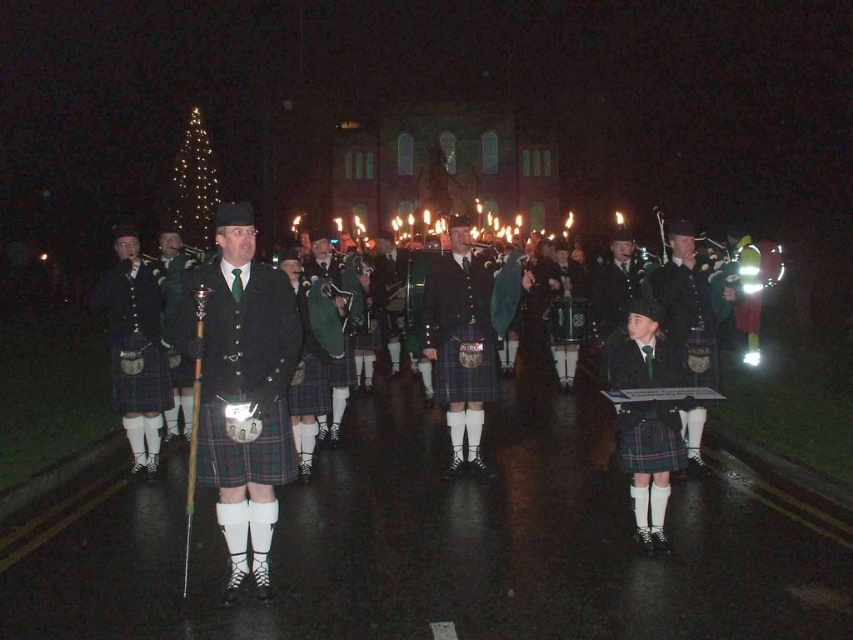
Is point (238, 452) behind point (491, 291)?

No, it is in front of (491, 291).

Which of these two, matte black kilt at center or plaid fabric kilt at center, stands shorter?

plaid fabric kilt at center

Is point (637, 298) in front of point (462, 276)?

Yes, it is in front of point (462, 276).

The image size is (853, 640). Find the location of `matte black kilt at center`. matte black kilt at center is located at coordinates (248, 388).

Between plaid kilt at center and matte black kilt at right, which one has more height?

Standing taller between the two is matte black kilt at right.

Is point (120, 381) positioned after point (664, 291)?

No.

At what (x,y) coordinates should I click in order to perform the action: click on plaid kilt at center. Please return your answer as a coordinate pair (x, y). The height and width of the screenshot is (640, 853). Looking at the image, I should click on (135, 348).

Identify the location of green plaid kilt at center. (242, 388).

Measure the distance between point (253, 224) and camera.

Point (253, 224) and camera are 54.14 meters apart from each other.

Between point (213, 336) and point (189, 372), which one is positioned behind?

The point (189, 372) is behind.

Locate an element on the screen. green plaid kilt at center is located at coordinates (242, 388).